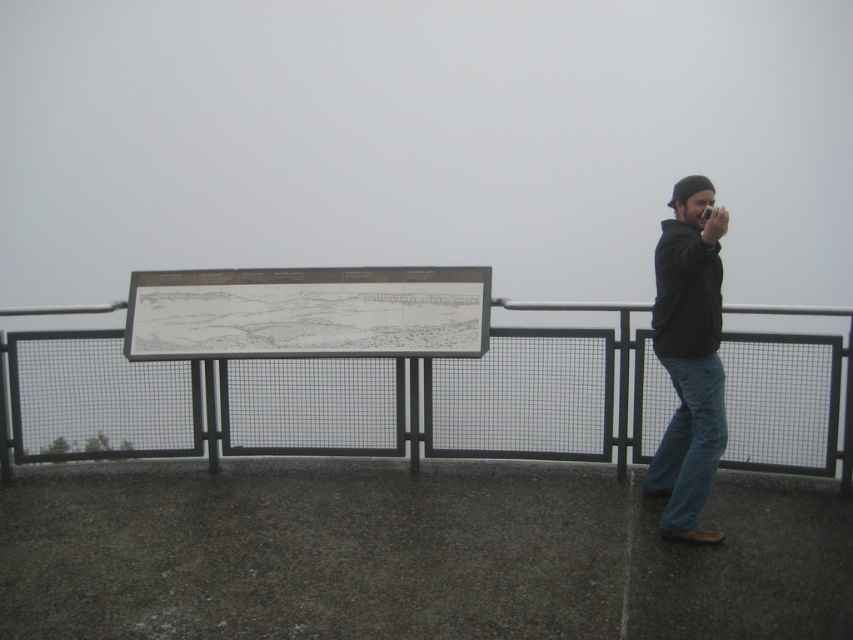
Can you confirm if black matte jacket at right is positioned to the left of denim at right?

In fact, black matte jacket at right is to the right of denim at right.

Which of these two, black matte jacket at right or denim at right, stands shorter?

denim at right

Is point (694, 292) less distant than point (677, 518)?

Yes, it is in front of point (677, 518).

The width and height of the screenshot is (853, 640). In order to click on black matte jacket at right in this screenshot , I will do `click(689, 356)`.

Looking at this image, can you confirm if metal mesh fence at center is positioned above black matte jacket at right?

No.

Does metal mesh fence at center have a greater height compared to black matte jacket at right?

In fact, metal mesh fence at center may be shorter than black matte jacket at right.

Who is more forward, [450,378] or [660,465]?

Point [660,465] is more forward.

This screenshot has height=640, width=853. I want to click on metal mesh fence at center, so click(341, 400).

I want to click on metal mesh fence at center, so coord(341,400).

Which of these two, metal mesh fence at center or denim at right, stands shorter?

Standing shorter between the two is denim at right.

Is point (743, 384) more distant than point (708, 408)?

That is True.

The height and width of the screenshot is (640, 853). Identify the location of metal mesh fence at center. (341, 400).